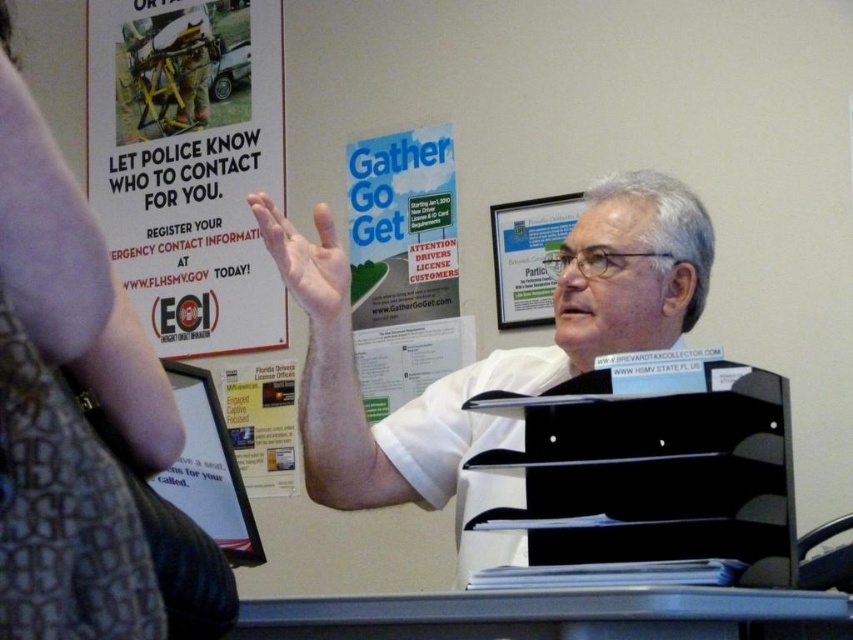
Question: Is the position of green paper at center less distant than that of matte white hand at center?

Choices:
 (A) no
 (B) yes

Answer: (A)

Question: Which point is closer to the camera taking this photo?

Choices:
 (A) (279, 440)
 (B) (122, 58)

Answer: (A)

Question: Can you confirm if white matte shirt at center is smaller than matte paper poster at center?

Choices:
 (A) no
 (B) yes

Answer: (A)

Question: Which point appears farthest from the camera in this image?

Choices:
 (A) (335, 250)
 (B) (244, 381)
 (C) (421, 208)

Answer: (B)

Question: Is white paper poster at upper left in front of matte paper poster at center?

Choices:
 (A) no
 (B) yes

Answer: (A)

Question: Which is nearer to the white paper poster at upper left?

Choices:
 (A) green paper at center
 (B) matte paper poster at center

Answer: (B)